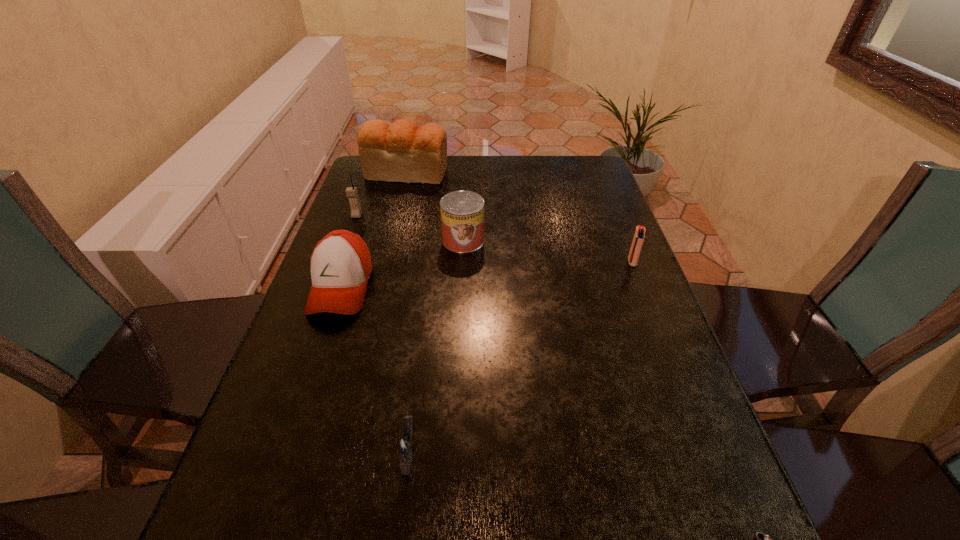
At what (x,y) coordinates should I click in order to perform the action: click on the closest object to the baseball cap. Please return your answer as a coordinate pair (x, y). Looking at the image, I should click on pyautogui.click(x=462, y=212).

Identify which object is the third nearest to the can. Please provide its 2D coordinates. Your answer should be formatted as a tuple, i.e. [(x, y)], where the tuple contains the x and y coordinates of a point satisfying the conditions above.

[(351, 192)]

The image size is (960, 540). I want to click on igniter that is the third closest to the baseball cap, so (x=759, y=539).

Choose which igniter is the third nearest neighbor to the fifth nearest object. Please provide its 2D coordinates. Your answer should be formatted as a tuple, i.e. [(x, y)], where the tuple contains the x and y coordinates of a point satisfying the conditions above.

[(759, 539)]

Find the location of a particular element. The width and height of the screenshot is (960, 540). vacant position in the image that satisfies the following two spatial constraints: 1. on the front of the can, where the keypad is located; 2. on the right side of the sixth nearest object is located at coordinates (348, 240).

Locate an element on the screen. free spot that satisfies the following two spatial constraints: 1. on the back side of the can; 2. on the left side of the leftmost igniter is located at coordinates (435, 240).